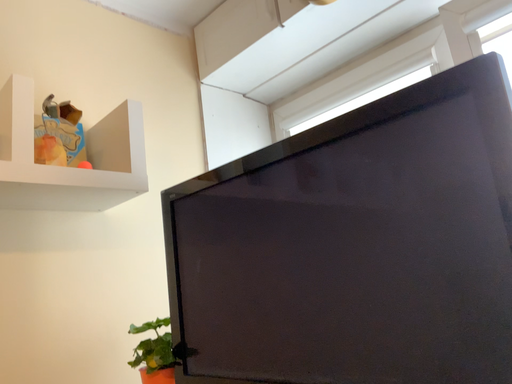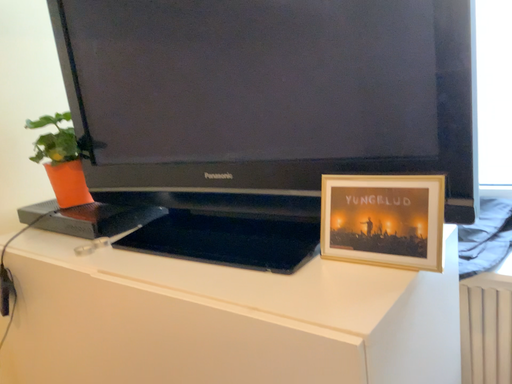
Question: How did the camera likely rotate when shooting the video?

Choices:
 (A) rotated left
 (B) rotated right

Answer: (B)